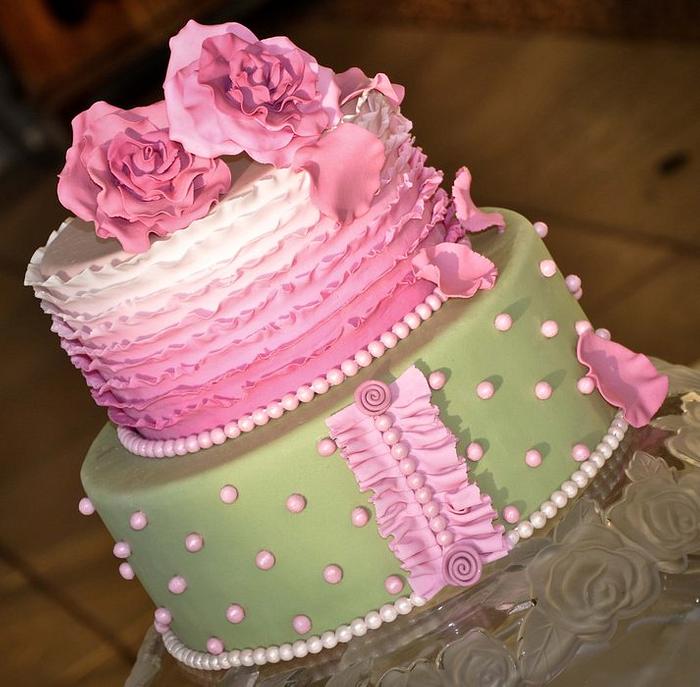
At what (x,y) coordinates should I click in order to perform the action: click on pink pearl decor. Please return your answer as a coordinate pair (x, y). Looking at the image, I should click on (476, 451).